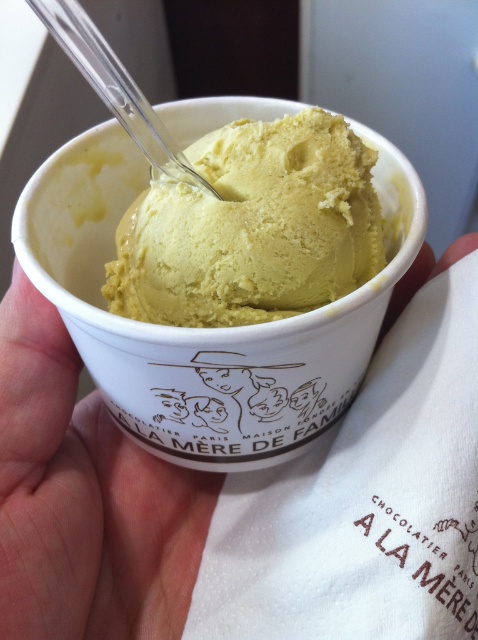
What is the position of the smooth skin at center in the image?

The smooth skin at center is located at point coordinates of (85, 499).

You are a food delivery person who needs to place the transparent plastic spoon at upper center into the yellow matte ice cream at center without touching the sides of the paper cup. Can you do it?

The distance between the yellow matte ice cream at center and the transparent plastic spoon at upper center is 5.70 inches. Since the spoon is positioned above the ice cream and there is sufficient space between them, you can safely place the spoon into the ice cream without touching the cup sides.